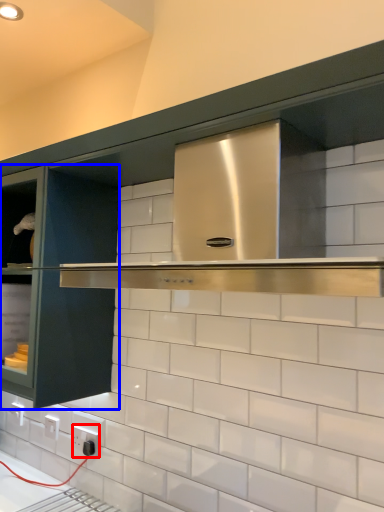
Question: Which of the following is the closest to the observer, electric outlet (highlighted by a red box) or glass door (highlighted by a blue box)?

Choices:
 (A) electric outlet
 (B) glass door

Answer: (B)